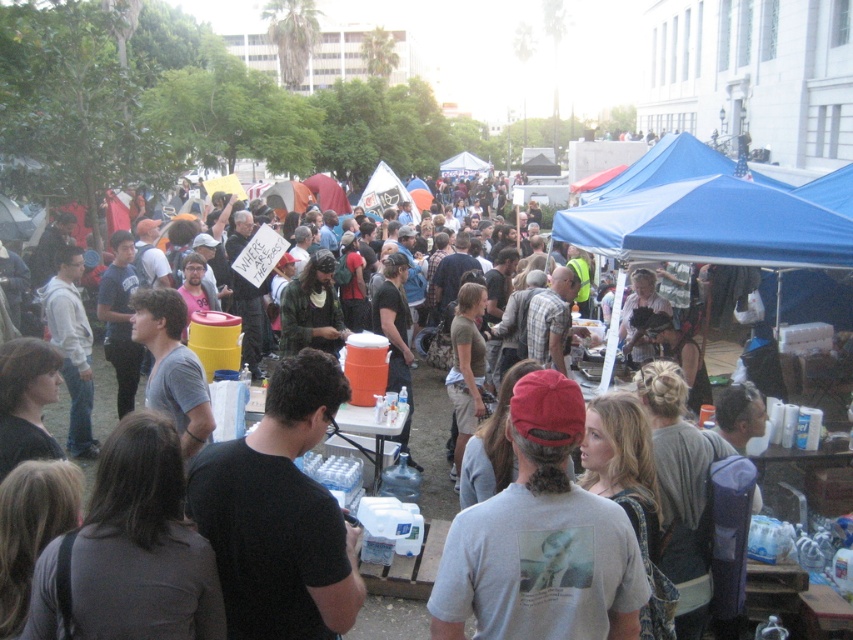
Can you confirm if blue fabric canopy at center-right is positioned below blue fabric canopy at upper center?

Yes, blue fabric canopy at center-right is below blue fabric canopy at upper center.

Consider the image. Can you confirm if blue fabric canopy at center-right is wider than blue fabric canopy at upper center?

No, blue fabric canopy at center-right is not wider than blue fabric canopy at upper center.

You are a GUI agent. You are given a task and a screenshot of the screen. Output one action in this format:
    pyautogui.click(x=<x>, y=<y>)
    Task: Click on the blue fabric canopy at center-right
    
    Given the screenshot: What is the action you would take?
    pyautogui.click(x=711, y=225)

Does gray cotton t-shirt at center appear on the right side of blue fabric canopy at center-right?

In fact, gray cotton t-shirt at center is to the left of blue fabric canopy at center-right.

Based on the photo, between gray cotton t-shirt at center and blue fabric canopy at center-right, which one has less height?

gray cotton t-shirt at center

Which is in front, point (579, 588) or point (781, 220)?

Positioned in front is point (579, 588).

The width and height of the screenshot is (853, 640). In order to click on gray cotton t-shirt at center in this screenshot , I will do `click(540, 540)`.

Between gray cotton t-shirt at center and blue fabric canopy at upper center, which one is positioned higher?

blue fabric canopy at upper center is higher up.

Is point (502, 502) positioned behind point (664, 134)?

No, it is in front of (664, 134).

Does point (535, 618) lie in front of point (602, 182)?

Yes, it is in front of point (602, 182).

This screenshot has height=640, width=853. Identify the location of gray cotton t-shirt at center. (540, 540).